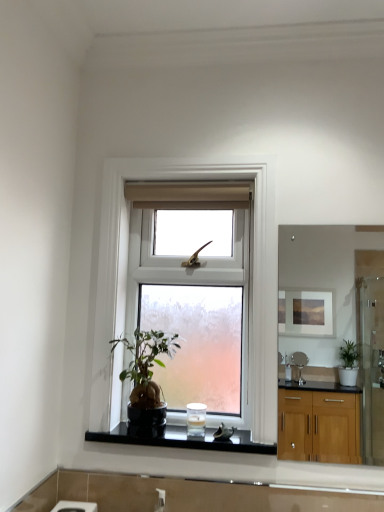
In order to click on vacant region in front of white frosted glass candle at center in this screenshot , I will do `click(193, 440)`.